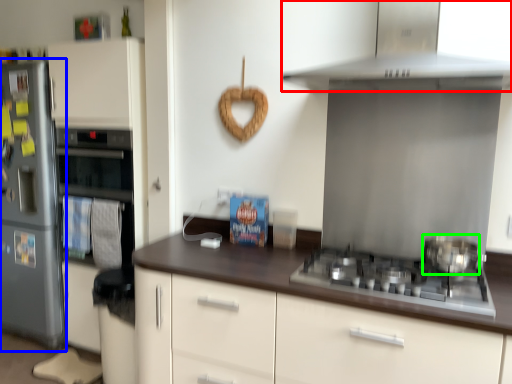
Question: Considering the real-world distances, which object is farthest from home appliance (highlighted by a red box)? refrigerator (highlighted by a blue box) or kitchen appliance (highlighted by a green box)?

Choices:
 (A) refrigerator
 (B) kitchen appliance

Answer: (A)